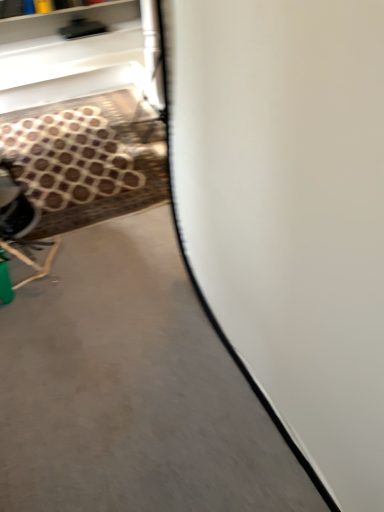
Where is `brown patterned carpet at lower left`? brown patterned carpet at lower left is located at coordinates (88, 159).

The width and height of the screenshot is (384, 512). What do you see at coordinates (88, 159) in the screenshot?
I see `brown patterned carpet at lower left` at bounding box center [88, 159].

The width and height of the screenshot is (384, 512). Describe the element at coordinates (131, 389) in the screenshot. I see `gray concrete at center` at that location.

Locate an element on the screen. gray concrete at center is located at coordinates (131, 389).

The image size is (384, 512). Find the location of `brown patterned carpet at lower left`. brown patterned carpet at lower left is located at coordinates (88, 159).

Consider the image. Which is more to the right, brown patterned carpet at lower left or gray concrete at center?

gray concrete at center is more to the right.

Is brown patterned carpet at lower left positioned before gray concrete at center?

No, it is not.

Is point (138, 190) closer to camera compared to point (146, 490)?

No, it is behind (146, 490).

From the image's perspective, is brown patterned carpet at lower left located above gray concrete at center?

Yes, from the image's perspective, brown patterned carpet at lower left is over gray concrete at center.

From a real-world perspective, is brown patterned carpet at lower left positioned above or below gray concrete at center?

Clearly, from a real-world perspective, brown patterned carpet at lower left is above gray concrete at center.

Between brown patterned carpet at lower left and gray concrete at center, which one has smaller width?

brown patterned carpet at lower left is thinner.

Is brown patterned carpet at lower left shorter than gray concrete at center?

Correct, brown patterned carpet at lower left is not as tall as gray concrete at center.

Based on their sizes in the image, would you say brown patterned carpet at lower left is bigger or smaller than gray concrete at center?

In the image, brown patterned carpet at lower left appears to be smaller than gray concrete at center.

Is brown patterned carpet at lower left outside of gray concrete at center?

No, most part of brown patterned carpet at lower left lies within gray concrete at center.

Would you consider brown patterned carpet at lower left to be distant from gray concrete at center?

brown patterned carpet at lower left is far away from gray concrete at center.

Is brown patterned carpet at lower left looking in the opposite direction of gray concrete at center?

Yes.

What's the angular difference between brown patterned carpet at lower left and gray concrete at center's facing directions?

The angle between the facing direction of brown patterned carpet at lower left and the facing direction of gray concrete at center is 0.000194 degrees.

Find the location of a particular element. Image resolution: width=384 pixels, height=512 pixels. stair located above the gray concrete at center (from the image's perspective) is located at coordinates (88, 159).

Which object is positioned more to the right, gray concrete at center or brown patterned carpet at lower left?

gray concrete at center.

Which object is closer to the camera taking this photo, gray concrete at center or brown patterned carpet at lower left?

gray concrete at center.

Which is in front, point (250, 414) or point (3, 120)?

The point (250, 414) is closer.

From the image's perspective, does gray concrete at center appear lower than brown patterned carpet at lower left?

Correct, gray concrete at center appears lower than brown patterned carpet at lower left in the image.

From a real-world perspective, is gray concrete at center located higher than brown patterned carpet at lower left?

No, from a real-world perspective, gray concrete at center is not on top of brown patterned carpet at lower left.

Which object is wider, gray concrete at center or brown patterned carpet at lower left?

gray concrete at center is wider.

Is gray concrete at center shorter than brown patterned carpet at lower left?

Incorrect, the height of gray concrete at center does not fall short of that of brown patterned carpet at lower left.

Can you confirm if gray concrete at center is smaller than brown patterned carpet at lower left?

No, gray concrete at center is not smaller than brown patterned carpet at lower left.

Would you say gray concrete at center contains brown patterned carpet at lower left?

Yes, brown patterned carpet at lower left can be found within gray concrete at center.

Is gray concrete at center placed right next to brown patterned carpet at lower left?

No, gray concrete at center is not with brown patterned carpet at lower left.

Is gray concrete at center turned away from brown patterned carpet at lower left?

Yes, gray concrete at center is facing away from brown patterned carpet at lower left.

Measure the distance from gray concrete at center to brown patterned carpet at lower left.

A distance of 3.58 feet exists between gray concrete at center and brown patterned carpet at lower left.

Find the location of `concrete in front of the brown patterned carpet at lower left`. concrete in front of the brown patterned carpet at lower left is located at coordinates (131, 389).

Where is `stair above the gray concrete at center (from the image's perspective)`? The height and width of the screenshot is (512, 384). stair above the gray concrete at center (from the image's perspective) is located at coordinates (88, 159).

Where is `stair behind the gray concrete at center`? This screenshot has height=512, width=384. stair behind the gray concrete at center is located at coordinates (88, 159).